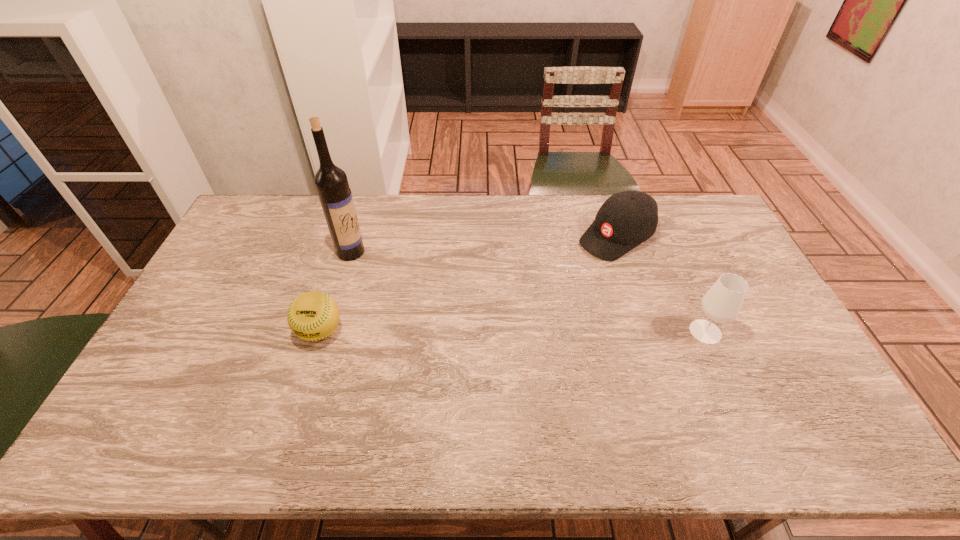
The width and height of the screenshot is (960, 540). In order to click on vacant space located on the label of the wine bottle in this screenshot , I will do click(446, 307).

At what (x,y) coordinates should I click in order to perform the action: click on free space located on the label of the wine bottle. Please return your answer as a coordinate pair (x, y). Looking at the image, I should click on (421, 292).

This screenshot has width=960, height=540. Find the location of `object at the far edge`. object at the far edge is located at coordinates (626, 219).

Find the location of a particular element. This screenshot has height=540, width=960. vacant space at the far edge is located at coordinates (545, 202).

In the image, there is a desktop. What are the coordinates of `vacant space at the near edge` in the screenshot? It's located at (705, 395).

The image size is (960, 540). Find the location of `free space at the left edge of the desktop`. free space at the left edge of the desktop is located at coordinates (252, 285).

Image resolution: width=960 pixels, height=540 pixels. I want to click on free space at the far left corner, so click(x=252, y=208).

Where is `vacant space at the far right corner of the desktop`? This screenshot has width=960, height=540. vacant space at the far right corner of the desktop is located at coordinates (680, 216).

Identify the location of vacant area between the baseball cap and the softball. (468, 284).

This screenshot has width=960, height=540. I want to click on free space between the baseball cap and the wine bottle, so click(484, 244).